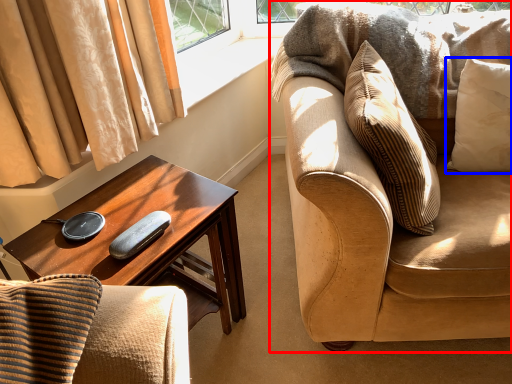
Question: Which point is closer to the camera, studio couch (highlighted by a red box) or pillow (highlighted by a blue box)?

Choices:
 (A) studio couch
 (B) pillow

Answer: (A)